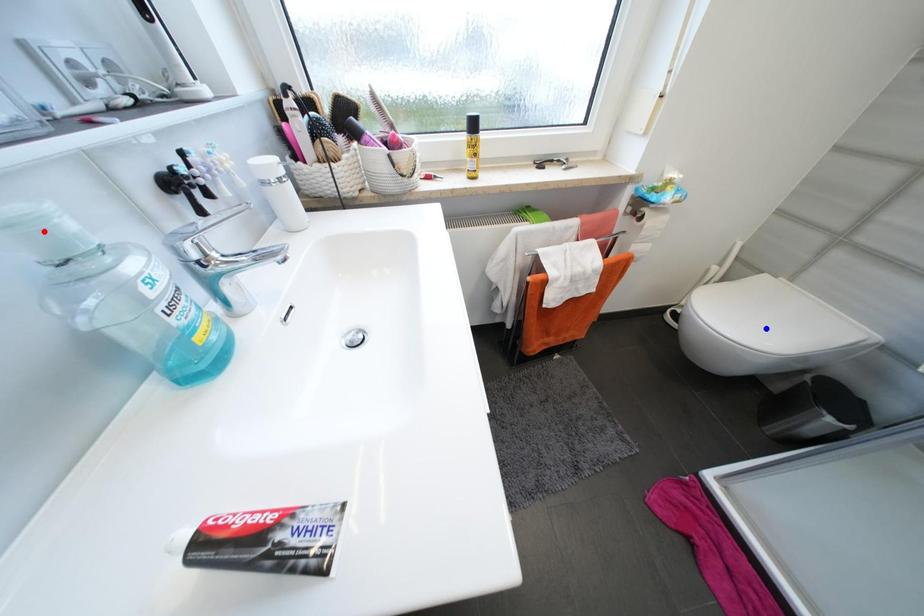
Question: In the image, two points are highlighted. Which point is nearer to the camera? Reply with the corresponding letter.

Choices:
 (A) blue point
 (B) red point

Answer: (B)